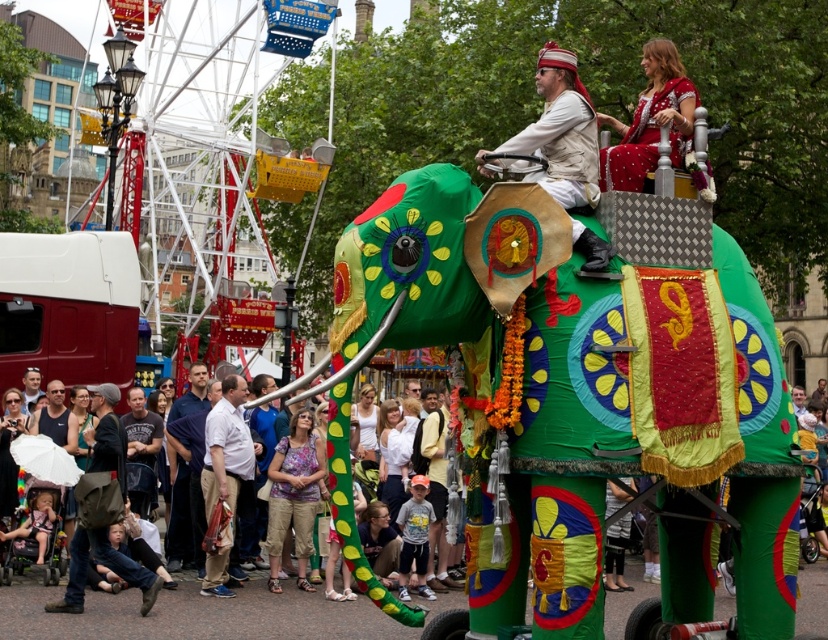
Find the location of a particular element. red embroidered dress at upper center is located at coordinates (651, 120).

Locate an element on the screen. The width and height of the screenshot is (828, 640). red embroidered dress at upper center is located at coordinates (651, 120).

Between white cotton shirt at center and matte white umbrella at lower left, which one has less height?

white cotton shirt at center

Who is more distant from viewer, (239, 403) or (224, 385)?

The point (224, 385) is behind.

Which is in front, point (227, 388) or point (384, 612)?

Point (384, 612) is in front.

Find the location of a particular element. The image size is (828, 640). white cotton shirt at center is located at coordinates (225, 448).

Between dark blue shirt at center and matte white umbrella at lower left, which one appears on the right side from the viewer's perspective?

From the viewer's perspective, matte white umbrella at lower left appears more on the right side.

Does dark blue shirt at center appear on the left side of matte white umbrella at lower left?

Indeed, dark blue shirt at center is positioned on the left side of matte white umbrella at lower left.

Find the location of a particular element. The image size is (828, 640). dark blue shirt at center is located at coordinates (183, 515).